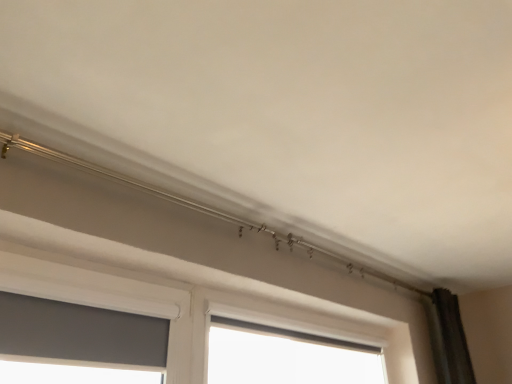
Where is `white matte window at lower left`? This screenshot has width=512, height=384. white matte window at lower left is located at coordinates (79, 334).

The image size is (512, 384). What do you see at coordinates (79, 334) in the screenshot?
I see `white matte window at lower left` at bounding box center [79, 334].

Locate an element on the screen. white matte window at lower left is located at coordinates (79, 334).